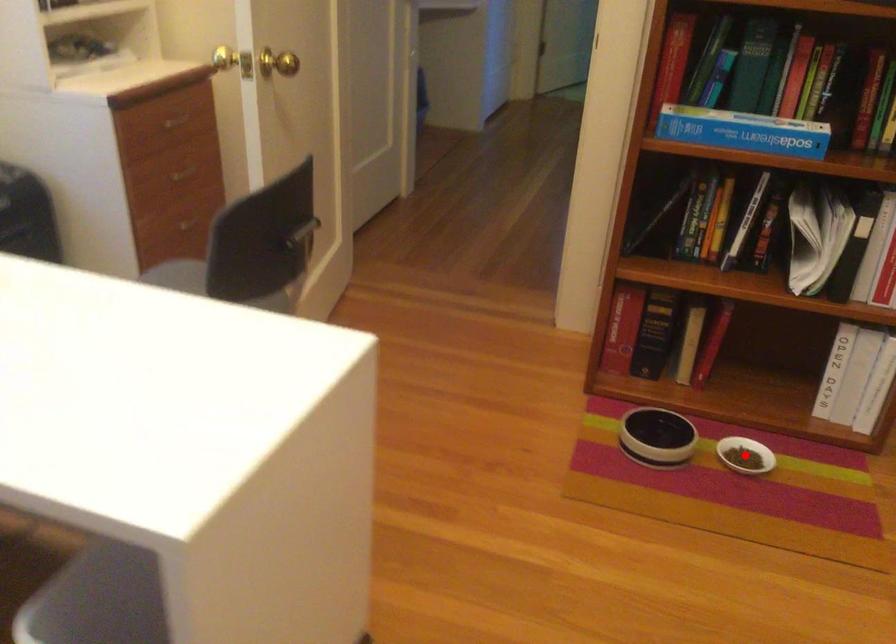
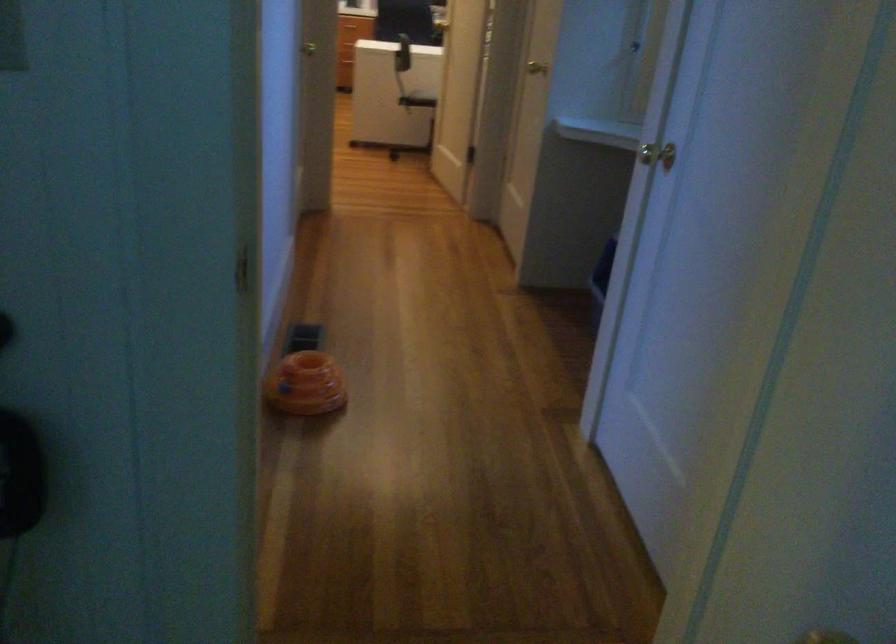
Question: I am providing you with two images of the same scene from different viewpoints. A red point is marked on the first image. Is the red point's position out of view in image 2?

Choices:
 (A) Yes
 (B) No

Answer: (A)